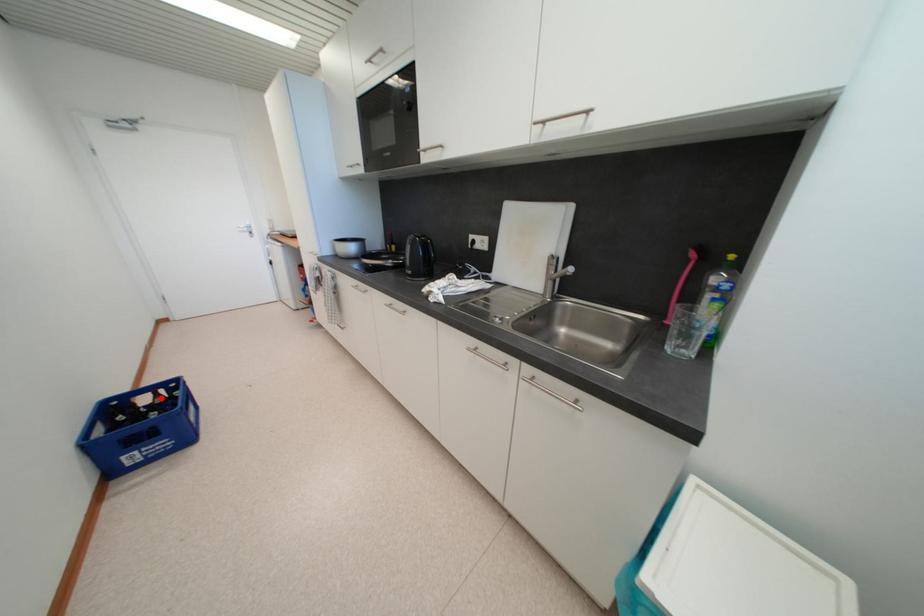
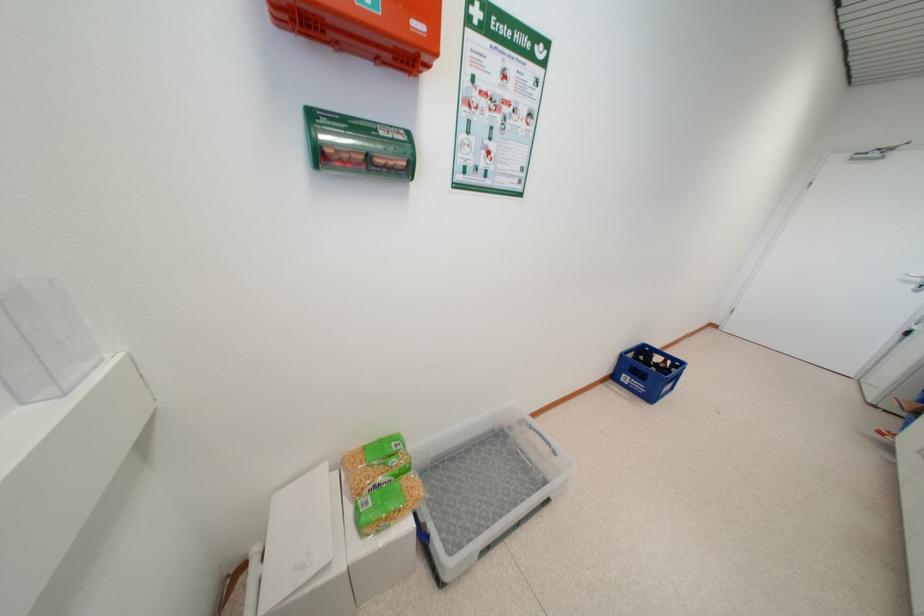
Question: I am providing you with two images of the same scene from different viewpoints. A red point is marked on the first image. Can you still see the location of the red point in image 2?

Choices:
 (A) Yes
 (B) No

Answer: (A)